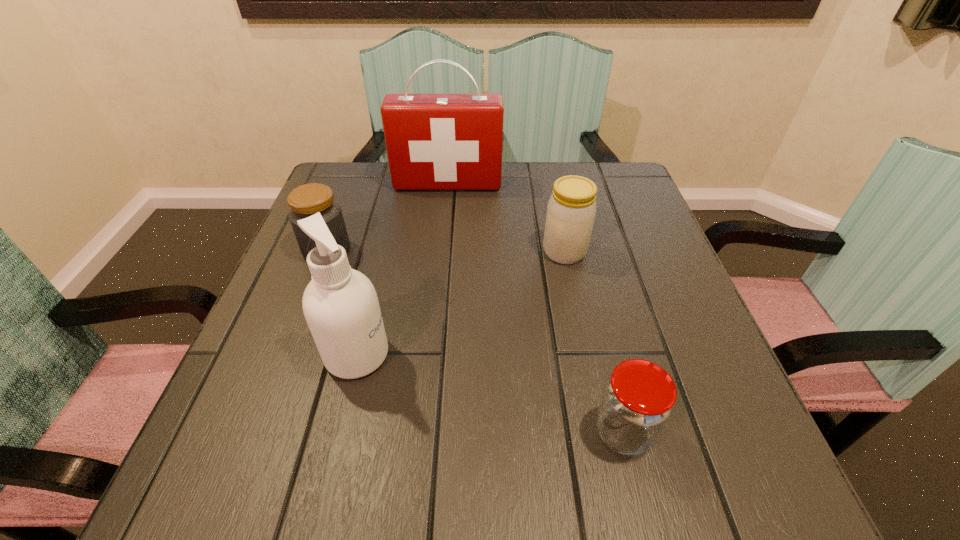
Where is `the farthest object`? The height and width of the screenshot is (540, 960). the farthest object is located at coordinates (434, 141).

Find the location of `cleansing agent`. cleansing agent is located at coordinates (340, 304).

Identify the location of the leftmost jar. (306, 200).

Where is `the nearest jar`? The width and height of the screenshot is (960, 540). the nearest jar is located at coordinates (637, 401).

Identify the location of free point located 0.390m on the front face of the first-aid kit. The width and height of the screenshot is (960, 540). (435, 309).

This screenshot has width=960, height=540. Find the location of `free location located on the front label of the second nearest object`. free location located on the front label of the second nearest object is located at coordinates (447, 355).

Locate an element on the screen. This screenshot has width=960, height=540. vacant space situated on the surface of the leftmost jar near the warning symbol is located at coordinates (257, 431).

Where is `free space located 0.110m on the left of the nearest object`? The image size is (960, 540). free space located 0.110m on the left of the nearest object is located at coordinates (518, 432).

Where is `object present at the far edge`? Image resolution: width=960 pixels, height=540 pixels. object present at the far edge is located at coordinates (434, 141).

In order to click on object present at the near edge in this screenshot , I will do `click(637, 401)`.